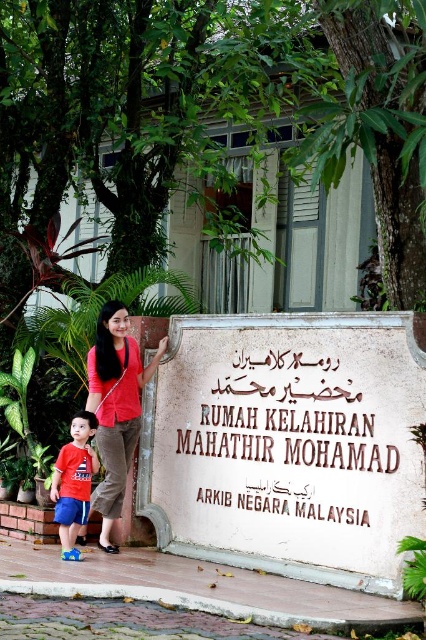
Is point (250, 456) less distant than point (80, 544)?

Yes, it is.

Can you confirm if white stone sign at center is taller than matte red shirt at center?

No, white stone sign at center is not taller than matte red shirt at center.

This screenshot has width=426, height=640. What do you see at coordinates (288, 444) in the screenshot?
I see `white stone sign at center` at bounding box center [288, 444].

This screenshot has height=640, width=426. I want to click on white stone sign at center, so click(x=288, y=444).

Can you confirm if matte red shirt at center is thinner than matte red t-shirt at lower left?

Incorrect, matte red shirt at center's width is not less than matte red t-shirt at lower left's.

In order to click on matte red shirt at center in this screenshot , I will do `click(115, 410)`.

Identify the location of matte red shirt at center. This screenshot has height=640, width=426. (115, 410).

Who is taller, white stone sign at center or matte red t-shirt at lower left?

white stone sign at center

Does white stone sign at center have a greater width compared to matte red t-shirt at lower left?

Indeed, white stone sign at center has a greater width compared to matte red t-shirt at lower left.

Locate an element on the screen. Image resolution: width=426 pixels, height=640 pixels. white stone sign at center is located at coordinates (288, 444).